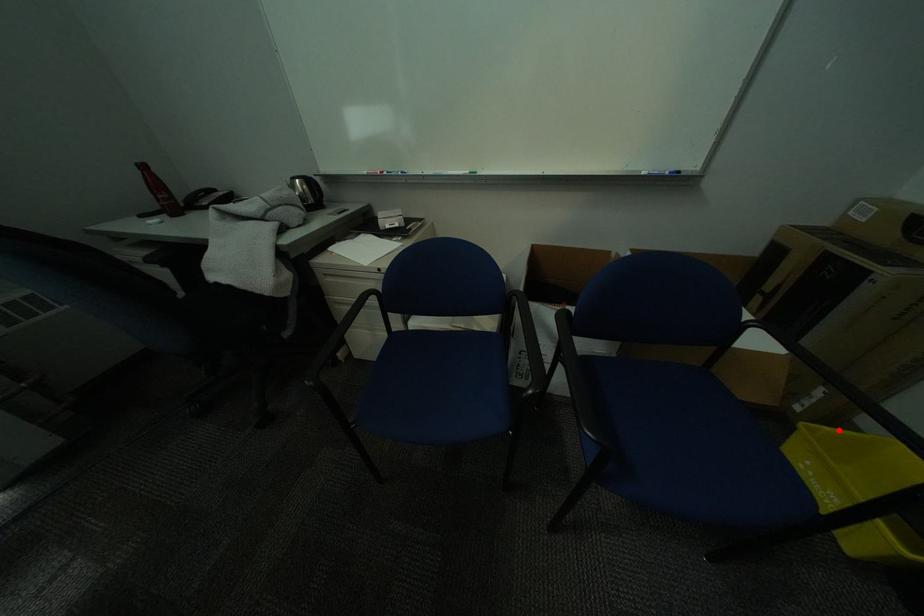
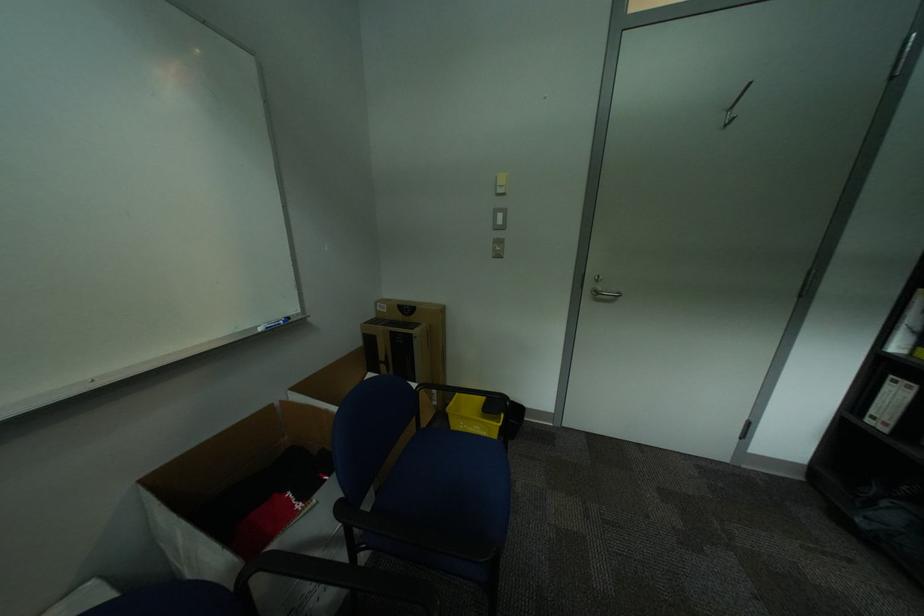
Question: I am providing you with two images of the same scene from different viewpoints. Image1 has a red point marked. In image2, the corresponding 3D location appears at what relative position? Reply with the corresponding letter.

Choices:
 (A) Closer
 (B) Farther

Answer: (A)